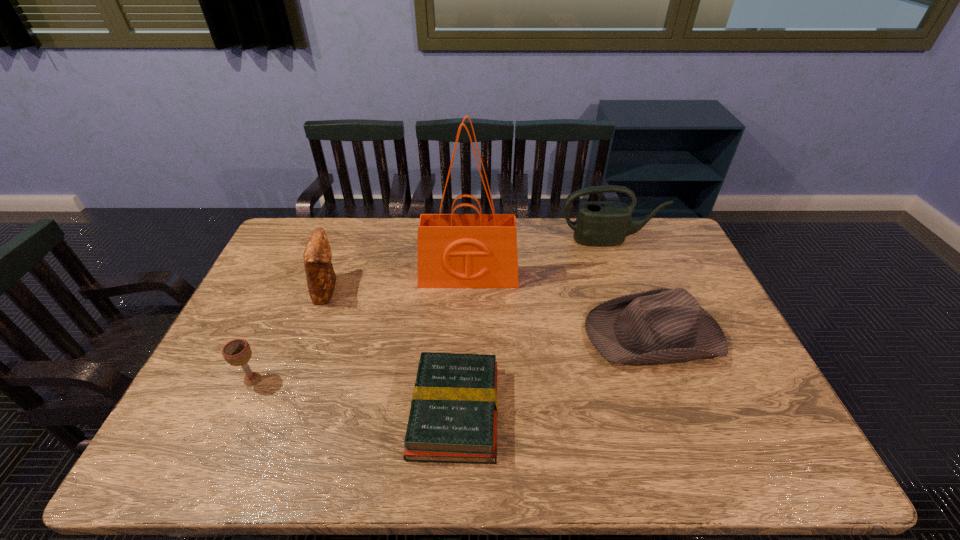
At what (x,y) coordinates should I click in order to perform the action: click on the tallest object. Please return your answer as a coordinate pair (x, y). Looking at the image, I should click on (478, 250).

Find the location of a particular element. The image size is (960, 540). the farthest object is located at coordinates point(602,223).

This screenshot has height=540, width=960. I want to click on clutch bag, so click(x=320, y=275).

Locate an element on the screen. Image resolution: width=960 pixels, height=540 pixels. the third tallest object is located at coordinates (320, 275).

The height and width of the screenshot is (540, 960). Identify the location of fedora. (661, 325).

What are the coordinates of `chalice` in the screenshot? It's located at (237, 352).

You are a GUI agent. You are given a task and a screenshot of the screen. Output one action in this format:
    pyautogui.click(x=<x>, y=<y>)
    Task: Click on the shortest object
    This screenshot has height=540, width=960.
    Given the screenshot: What is the action you would take?
    pyautogui.click(x=453, y=418)

Image resolution: width=960 pixels, height=540 pixels. What are the coordinates of `free space located on the logo side of the tallest object` in the screenshot? It's located at click(x=467, y=345).

Find the location of a particular element. The width and height of the screenshot is (960, 540). free space located on the spout of the watering can is located at coordinates (621, 273).

Where is `free space located on the open side of the fifth object from right to left`? This screenshot has height=540, width=960. free space located on the open side of the fifth object from right to left is located at coordinates (399, 289).